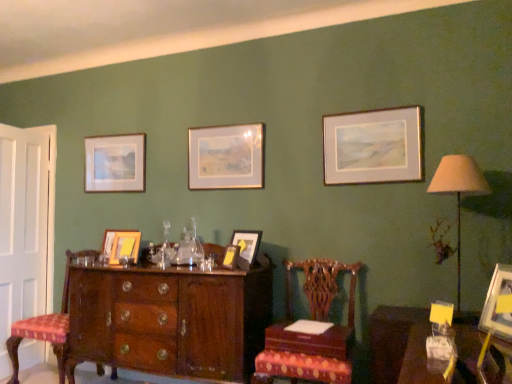
Question: Is the surface of matte gold picture frame at center, the 2th picture frame from the front, in direct contact with mahogany wood chair at center, the second chair in the left-to-right sequence?

Choices:
 (A) no
 (B) yes

Answer: (A)

Question: From the image's perspective, is matte gold picture frame at center, the 2th picture frame from the front, over mahogany wood chair at center, the second chair in the left-to-right sequence?

Choices:
 (A) no
 (B) yes

Answer: (B)

Question: Does matte gold picture frame at center, the 6th picture frame from the back, turn towards mahogany wood chair at center, the second chair in the left-to-right sequence?

Choices:
 (A) yes
 (B) no

Answer: (B)

Question: Is matte gold picture frame at center, which is counted as the 4th picture frame, starting from the left, not near mahogany wood chair at center, the second chair in the left-to-right sequence?

Choices:
 (A) yes
 (B) no

Answer: (B)

Question: From the image's perspective, is matte gold picture frame at center, which is counted as the 4th picture frame, starting from the left, below mahogany wood chair at center, positioned as the 1th chair in right-to-left order?

Choices:
 (A) no
 (B) yes

Answer: (A)

Question: Is matte gold picture frame at center, the 6th picture frame from the back, bigger than mahogany wood chair at center, which is counted as the 1th chair, starting from the front?

Choices:
 (A) no
 (B) yes

Answer: (A)

Question: Is gold metallic picture frame at upper right, arranged as the 5th picture frame when viewed from the back, facing away from wooden table at lower right?

Choices:
 (A) no
 (B) yes

Answer: (A)

Question: Considering the relative positions of gold metallic picture frame at upper right, placed as the 2th picture frame when sorted from right to left, and wooden table at lower right in the image provided, is gold metallic picture frame at upper right, placed as the 2th picture frame when sorted from right to left, behind wooden table at lower right?

Choices:
 (A) yes
 (B) no

Answer: (A)

Question: From a real-world perspective, is gold metallic picture frame at upper right, placed as the 2th picture frame when sorted from right to left, positioned over wooden table at lower right based on gravity?

Choices:
 (A) yes
 (B) no

Answer: (A)

Question: Does gold metallic picture frame at upper right, the third picture frame positioned from the front, appear on the right side of wooden table at lower right?

Choices:
 (A) yes
 (B) no

Answer: (B)

Question: Considering the relative sizes of gold metallic picture frame at upper right, the third picture frame positioned from the front, and wooden table at lower right in the image provided, is gold metallic picture frame at upper right, the third picture frame positioned from the front, bigger than wooden table at lower right?

Choices:
 (A) no
 (B) yes

Answer: (A)

Question: From the image's perspective, is gold metallic picture frame at upper right, placed as the 2th picture frame when sorted from right to left, above wooden table at lower right?

Choices:
 (A) yes
 (B) no

Answer: (A)

Question: From a real-world perspective, is wooden table at lower right on top of beige fabric lampshade at right?

Choices:
 (A) no
 (B) yes

Answer: (A)